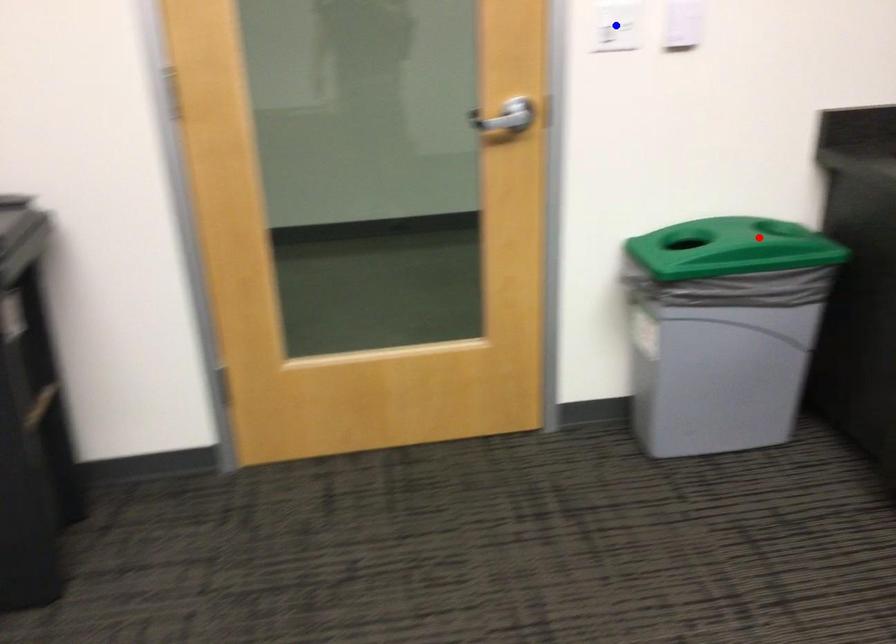
Question: Which of the two points in the image is closer to the camera?

Choices:
 (A) Blue point is closer.
 (B) Red point is closer.

Answer: (A)